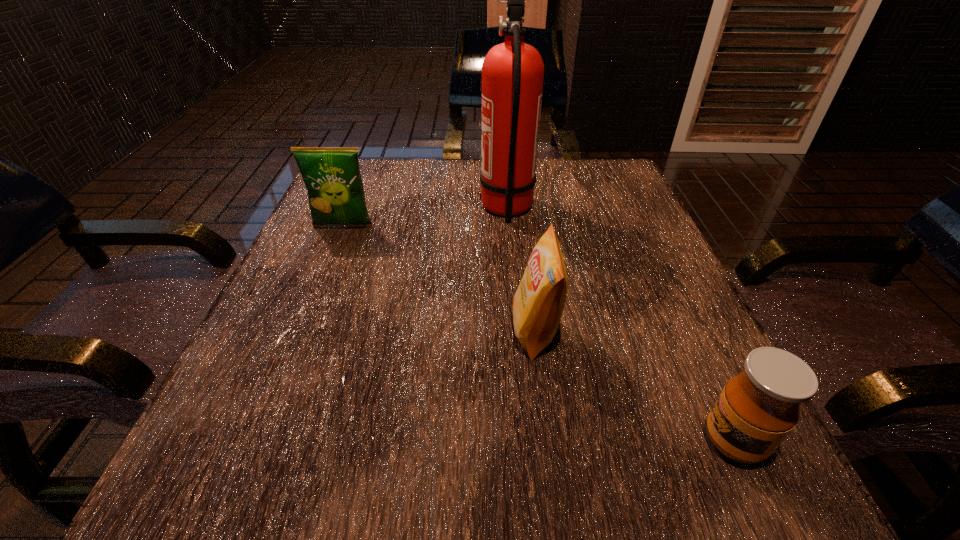
Find the location of `vacant space that satisfies the following two spatial constraints: 1. on the handle side of the fire extinguisher; 2. on the front-facing side of the farther crisp (potato chip)`. vacant space that satisfies the following two spatial constraints: 1. on the handle side of the fire extinguisher; 2. on the front-facing side of the farther crisp (potato chip) is located at coordinates (509, 226).